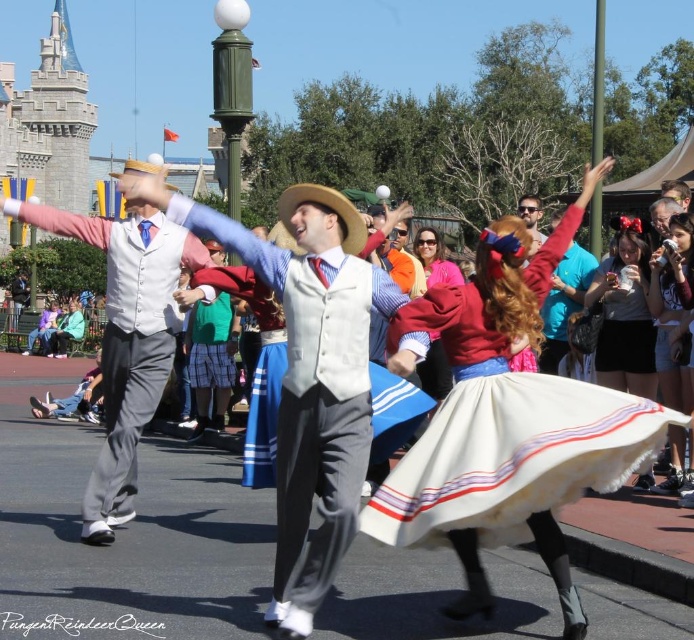
Question: Which point is farther to the camera?

Choices:
 (A) white cotton skirt at center
 (B) matte white dress at center

Answer: (B)

Question: Is matte pink vest at center positioned behind matte white dress at center?

Choices:
 (A) yes
 (B) no

Answer: (B)

Question: Which point is farther to the camera?

Choices:
 (A) matte black dress at center
 (B) green plaid skirt at center
 (C) matte white dress at center

Answer: (A)

Question: Does white cotton skirt at center appear on the right side of matte white dress at center?

Choices:
 (A) yes
 (B) no

Answer: (B)

Question: Which of the following is the farthest from the observer?

Choices:
 (A) (430, 369)
 (B) (611, 387)

Answer: (A)

Question: Does white cotton skirt at center appear on the left side of white matte vest at center?

Choices:
 (A) yes
 (B) no

Answer: (B)